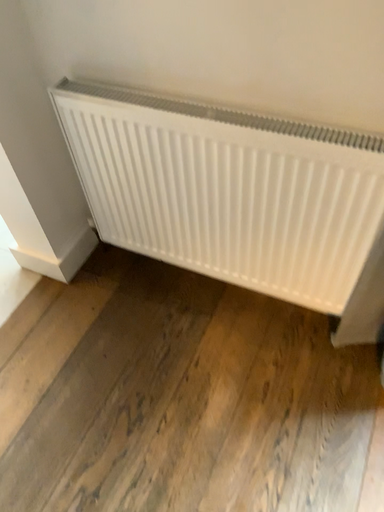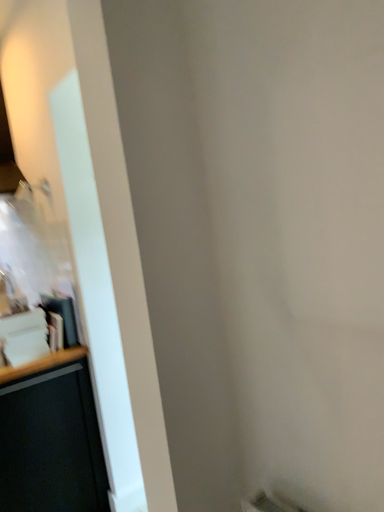
Question: Which way did the camera rotate in the video?

Choices:
 (A) rotated left
 (B) rotated right

Answer: (A)